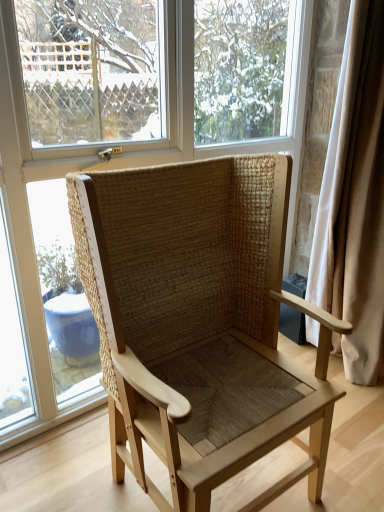
Question: From the image's perspective, is white fabric curtain at right positioned above or below transparent glass window at center?

Choices:
 (A) above
 (B) below

Answer: (B)

Question: From a real-world perspective, relative to transparent glass window at center, is white fabric curtain at right vertically above or below?

Choices:
 (A) below
 (B) above

Answer: (A)

Question: Which is farther from the white fabric curtain at right?

Choices:
 (A) transparent glass window at center
 (B) natural woven wood chair at center

Answer: (B)

Question: Which is farther from the transparent glass window at center?

Choices:
 (A) white fabric curtain at right
 (B) natural woven wood chair at center

Answer: (A)